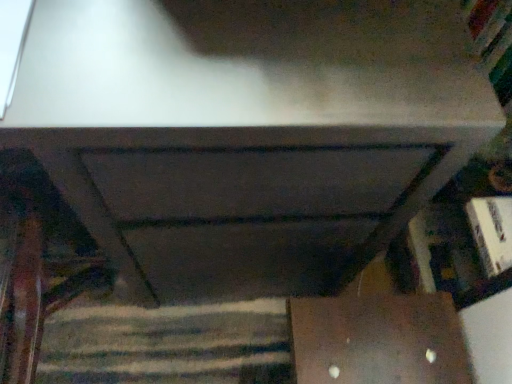
What do you see at coordinates (492, 232) in the screenshot? I see `white matte paperback book at lower right` at bounding box center [492, 232].

This screenshot has height=384, width=512. I want to click on white matte paperback book at lower right, so click(492, 232).

Where is `white matte paperback book at lower right`? The height and width of the screenshot is (384, 512). white matte paperback book at lower right is located at coordinates point(492,232).